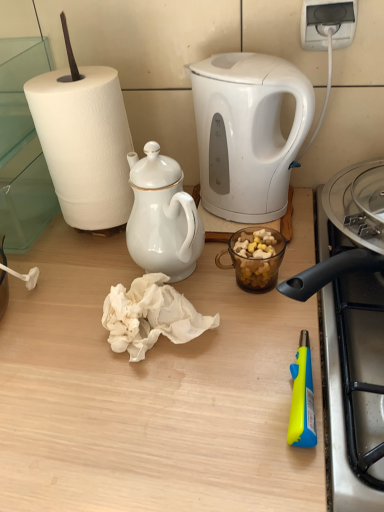
The width and height of the screenshot is (384, 512). Identify the location of vacant area to the left of translucent glass mug at center. (130, 282).